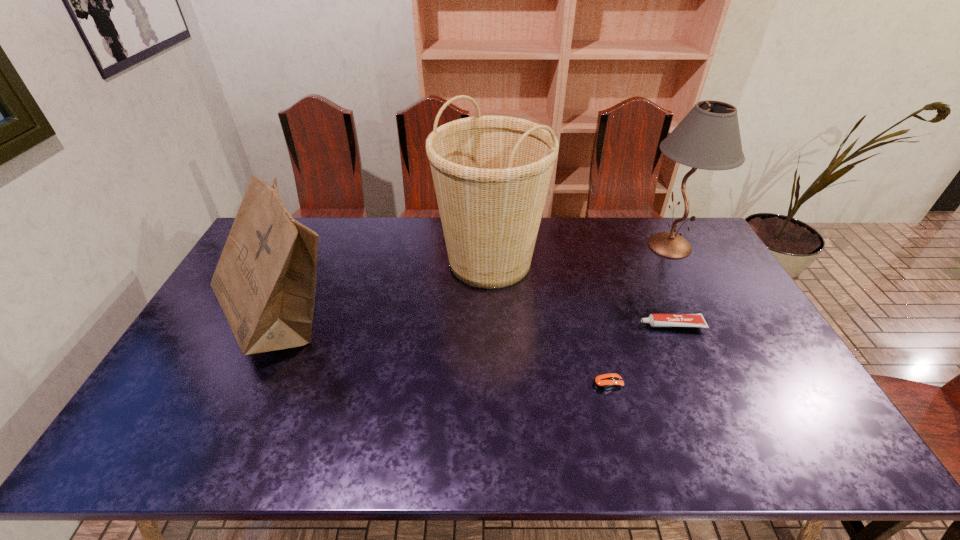
Find the location of a particular element. the fourth object from right to left is located at coordinates (491, 174).

The image size is (960, 540). Identify the location of table lamp. (708, 137).

Identify the location of grocery bag. The width and height of the screenshot is (960, 540). (265, 281).

Locate an element on the screen. The width and height of the screenshot is (960, 540). the third shortest object is located at coordinates (265, 281).

The height and width of the screenshot is (540, 960). I want to click on the fourth tallest object, so click(x=655, y=320).

You are a GUI agent. You are given a task and a screenshot of the screen. Output one action in this format:
    pyautogui.click(x=<x>, y=<y>)
    Task: Click on the computer mouse
    This screenshot has height=540, width=960.
    Given the screenshot: What is the action you would take?
    pyautogui.click(x=602, y=382)

The height and width of the screenshot is (540, 960). I want to click on the third object from left to right, so click(602, 382).

Locate an element on the screen. vacant space situated 0.100m on the right of the fourth object from right to left is located at coordinates (573, 261).

Image resolution: width=960 pixels, height=540 pixels. I want to click on free space located on the front-facing side of the table lamp, so click(x=566, y=246).

What are the coordinates of `free spot located on the front-facing side of the table lamp` in the screenshot? It's located at (599, 246).